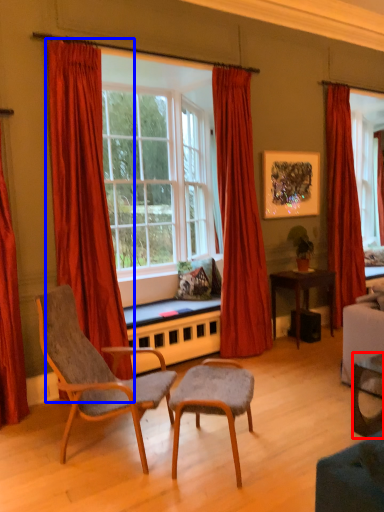
Question: Which object is further to the camera taking this photo, desk (highlighted by a red box) or curtain (highlighted by a blue box)?

Choices:
 (A) desk
 (B) curtain

Answer: (B)